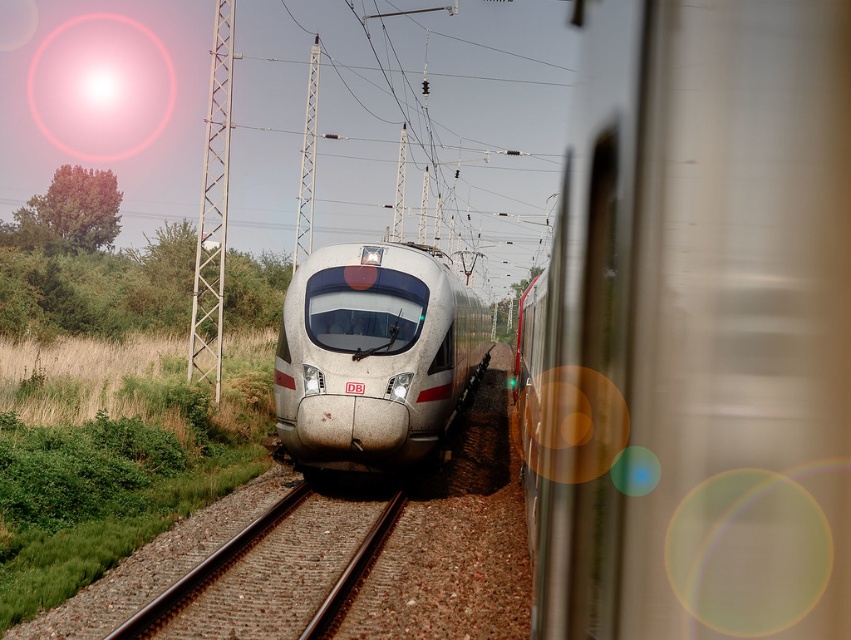
Question: Estimate the real-world distances between objects in this image. Which object is farther from the transparent glass train window at center?

Choices:
 (A) metallic train at center
 (B) silver metallic bullet train at center

Answer: (A)

Question: Among these objects, which one is farthest from the camera?

Choices:
 (A) silver metallic bullet train at center
 (B) transparent glass train window at center

Answer: (B)

Question: Based on their relative distances, which object is farther from the transparent glass train window at center?

Choices:
 (A) metallic train at center
 (B) silver metallic bullet train at center

Answer: (A)

Question: Is metallic train at center positioned in front of silver metallic bullet train at center?

Choices:
 (A) yes
 (B) no

Answer: (A)

Question: Does metallic train at center have a lesser width compared to transparent glass train window at center?

Choices:
 (A) yes
 (B) no

Answer: (A)

Question: Observing the image, what is the correct spatial positioning of metallic train at center in reference to transparent glass train window at center?

Choices:
 (A) below
 (B) above

Answer: (A)